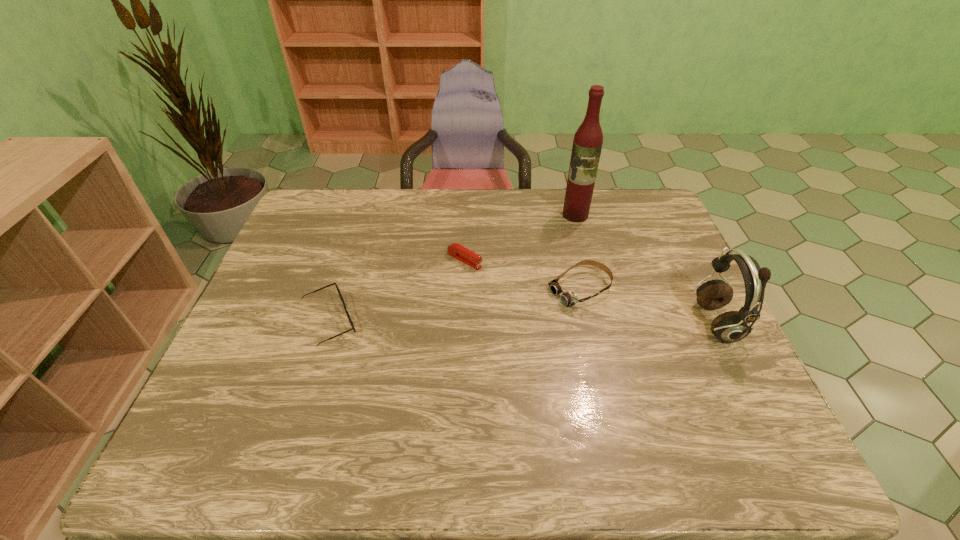
At what (x,y) coordinates should I click in order to perform the action: click on vacant space that satisfies the following two spatial constraints: 1. on the front side of the stapler; 2. on the ear pads of the rightmost object. Please return your answer as a coordinate pair (x, y). Looking at the image, I should click on (463, 323).

At what (x,y) coordinates should I click in order to perform the action: click on vacant space that satisfies the following two spatial constraints: 1. on the back side of the liquor; 2. on the right side of the goggles. Please return your answer as a coordinate pair (x, y). Image resolution: width=960 pixels, height=540 pixels. Looking at the image, I should click on (563, 215).

I want to click on free point that satisfies the following two spatial constraints: 1. on the front side of the shortest object; 2. on the ear pads of the rightmost object, so click(x=463, y=323).